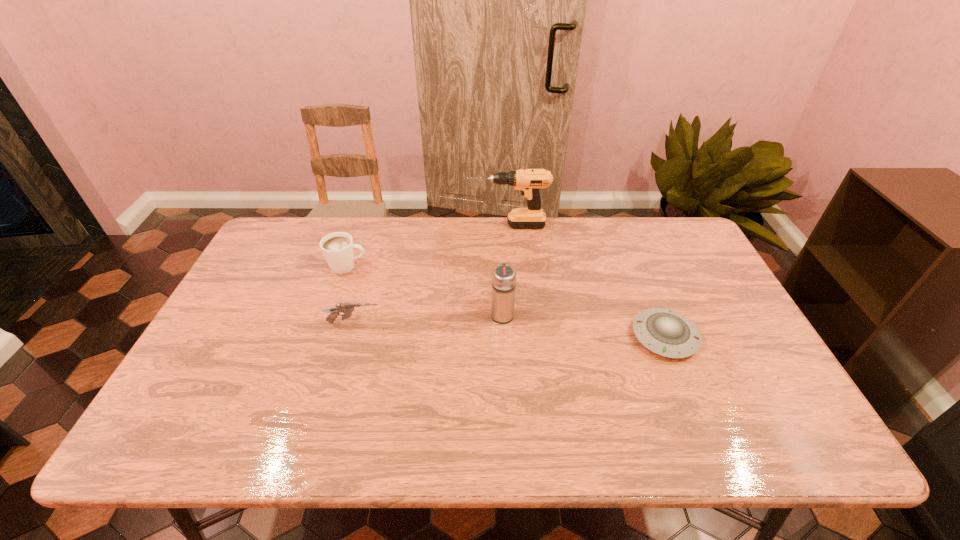
Locate an element on the screen. free space at the far edge of the desktop is located at coordinates (599, 249).

Where is `vacant space at the near edge of the desktop`? This screenshot has width=960, height=540. vacant space at the near edge of the desktop is located at coordinates (531, 434).

In the image, there is a desktop. In order to click on free region at the left edge in this screenshot , I will do `click(249, 370)`.

Locate an element on the screen. vacant space at the right edge is located at coordinates (746, 368).

Image resolution: width=960 pixels, height=540 pixels. I want to click on vacant area at the far left corner of the desktop, so click(x=286, y=248).

Identify the location of free space at the far right corner. The height and width of the screenshot is (540, 960). (662, 232).

Where is `vacant region between the cappuccino and the second shortest object`? vacant region between the cappuccino and the second shortest object is located at coordinates (350, 294).

I want to click on vacant region between the cappuccino and the fourth shortest object, so click(425, 290).

Find the location of a particular element. The image size is (960, 540). free spot between the second tallest object and the saucer is located at coordinates (584, 325).

The image size is (960, 540). In order to click on unoccupied position between the fourth tallest object and the thermos bottle in this screenshot , I will do `click(428, 318)`.